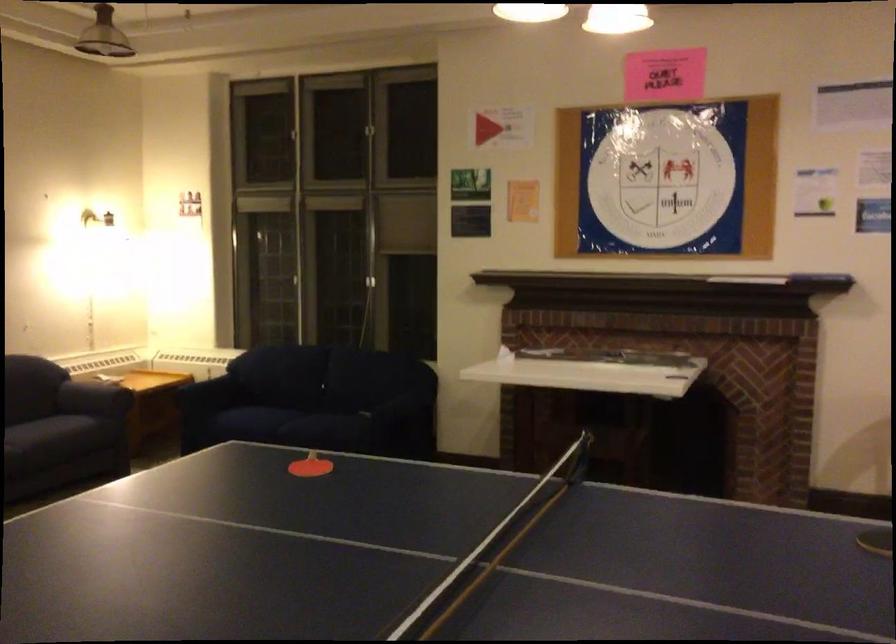
Where would you rest the dark sofa armrest? Please return your answer as a coordinate pair (x, y).

(95, 398)